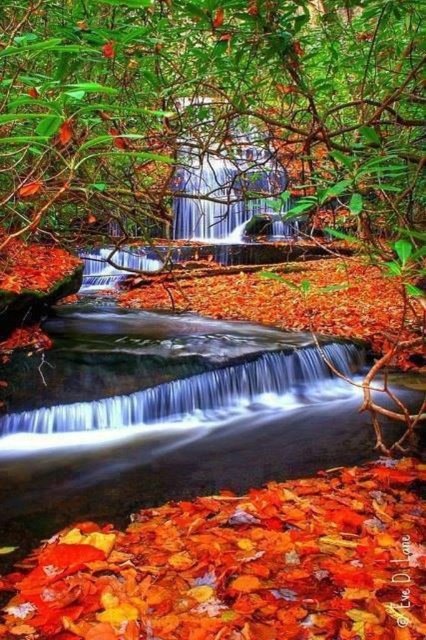
You are a photographer trying to capture the waterfall and its surroundings. You notice the shiny red leaves at center and the white smooth water at center. Which object is shorter in height?

The shiny red leaves at center is not as tall as the white smooth water at center, so the shiny red leaves at center is shorter in height.